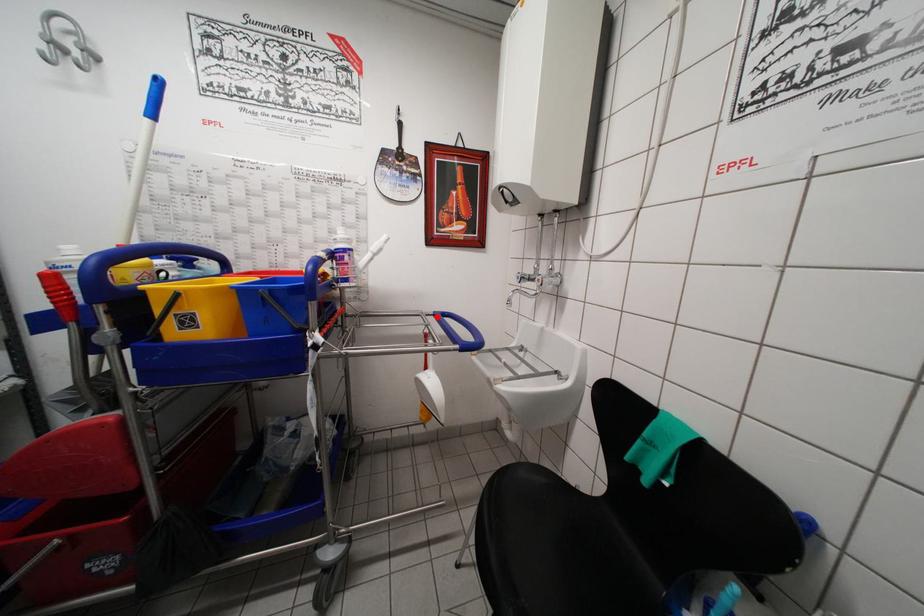
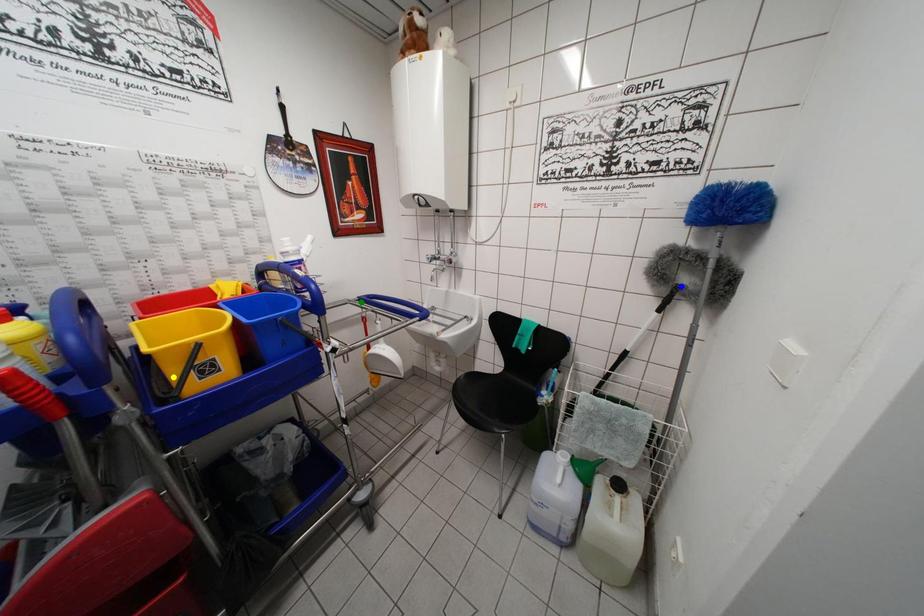
Question: I am providing you with two images of the same scene from different viewpoints. A red point is marked on the first image. You are given multiple points on the second image. Which spot in image 2 lines up with the point in image 1?

Choices:
 (A) blue point
 (B) green point
 (C) yellow point

Answer: (B)